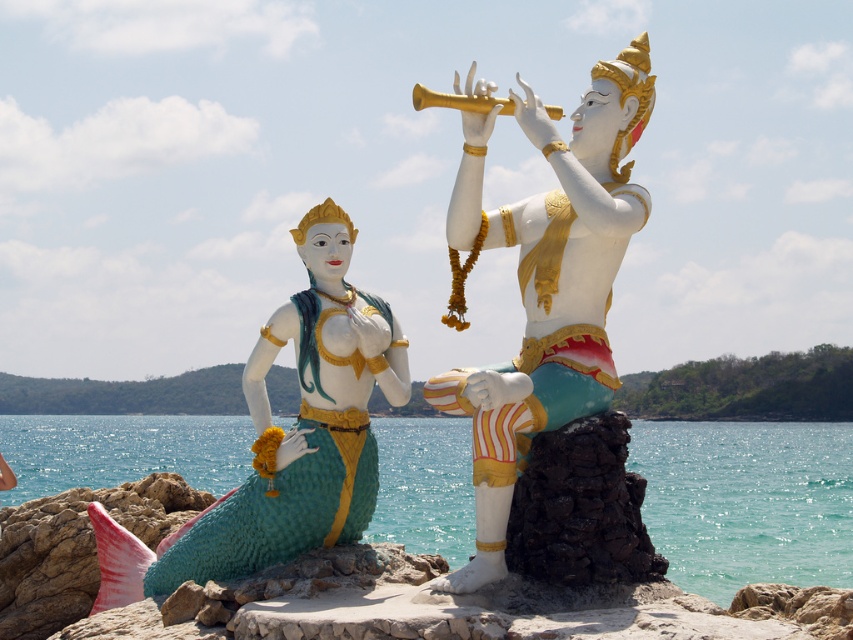
Question: Which point is farther to the camera?

Choices:
 (A) (331, 264)
 (B) (473, 106)

Answer: (A)

Question: Among these points, which one is nearest to the camera?

Choices:
 (A) coord(556,237)
 (B) coord(724,588)
 (C) coord(323,300)
 (D) coord(412,104)

Answer: (A)

Question: Can you confirm if teal glossy water at lower center is positioned to the left of matte green mermaid statue at left?

Choices:
 (A) yes
 (B) no

Answer: (B)

Question: Is white glossy statue at center positioned behind gold metallic trumpet at upper center?

Choices:
 (A) yes
 (B) no

Answer: (B)

Question: In this image, where is teal glossy water at lower center located relative to white glossy statue at center?

Choices:
 (A) left
 (B) right

Answer: (B)

Question: Estimate the real-world distances between objects in this image. Which object is closer to the gold metallic trumpet at upper center?

Choices:
 (A) matte green mermaid statue at left
 (B) teal glossy water at lower center
 (C) white glossy statue at center

Answer: (C)